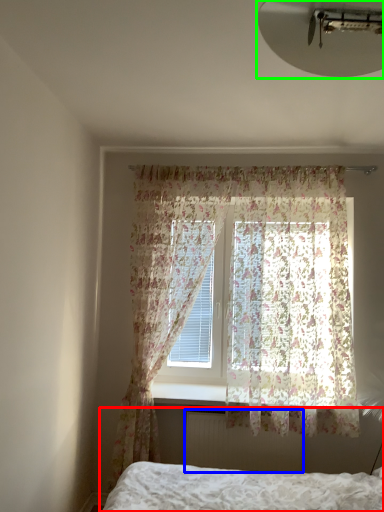
Question: Which object is positioned farthest from bed (highlighted by a red box)? Select from radiator (highlighted by a blue box) and light fixture (highlighted by a green box).

Choices:
 (A) radiator
 (B) light fixture

Answer: (B)